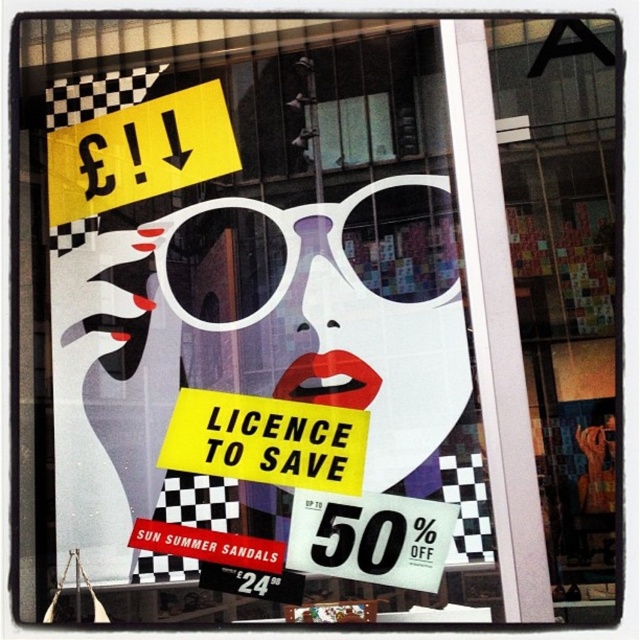
Is point (554, 474) closer to viewer compared to point (353, 284)?

Yes, it is in front of point (353, 284).

Who is positioned more to the left, checkerboard glass at upper right or white plastic goggles at center?

white plastic goggles at center

Identify the location of checkerboard glass at upper right. This screenshot has width=640, height=640. (564, 285).

Where is `checkerboard glass at upper right`? This screenshot has width=640, height=640. checkerboard glass at upper right is located at coordinates (564, 285).

Is point (429, 394) closer to camera compared to point (292, 420)?

Yes, point (429, 394) is closer to viewer.

Can you confirm if matte white sunglasses at center is bigger than yellow paper at center?

Yes, matte white sunglasses at center is bigger than yellow paper at center.

Does point (189, 522) come behind point (230, 468)?

No, (189, 522) is in front of (230, 468).

I want to click on matte white sunglasses at center, so click(266, 305).

Does matte white sunglasses at center have a larger size compared to white plastic goggles at center?

Indeed, matte white sunglasses at center has a larger size compared to white plastic goggles at center.

Is point (227, 106) farther from viewer compared to point (291, 234)?

Yes, point (227, 106) is farther from viewer.

The image size is (640, 640). Describe the element at coordinates (266, 305) in the screenshot. I see `matte white sunglasses at center` at that location.

This screenshot has height=640, width=640. Find the location of `matte white sunglasses at center`. matte white sunglasses at center is located at coordinates (266, 305).